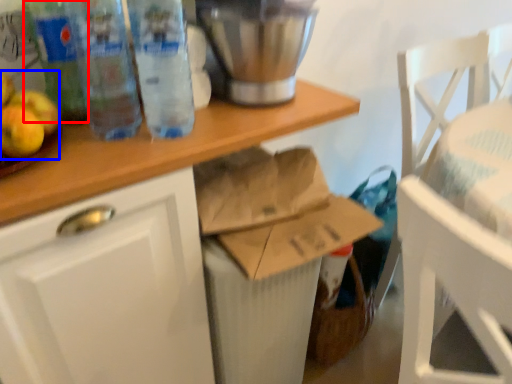
Question: Which object is closer to the camera taking this photo, bottle (highlighted by a red box) or apple (highlighted by a blue box)?

Choices:
 (A) bottle
 (B) apple

Answer: (B)